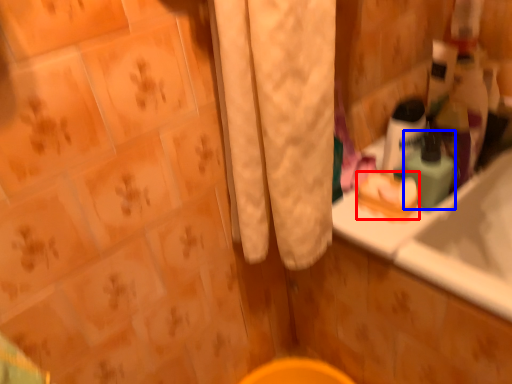
Question: Which of the following is the farthest to the observer, soap (highlighted by a red box) or mouthwash (highlighted by a blue box)?

Choices:
 (A) soap
 (B) mouthwash

Answer: (A)